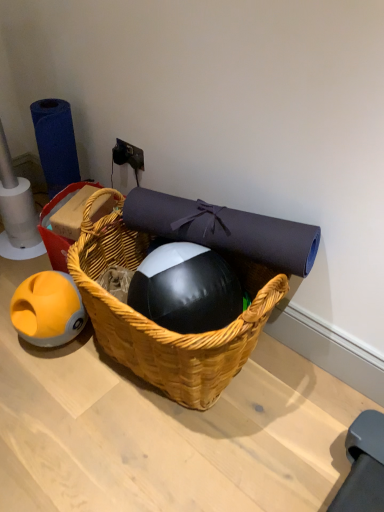
Question: Considering the relative positions of blue matte roll of toilet paper at left and woven wood picnic basket at center in the image provided, is blue matte roll of toilet paper at left to the right of woven wood picnic basket at center from the viewer's perspective?

Choices:
 (A) yes
 (B) no

Answer: (B)

Question: Can you confirm if blue matte roll of toilet paper at left is positioned to the left of woven wood picnic basket at center?

Choices:
 (A) no
 (B) yes

Answer: (B)

Question: Is blue matte roll of toilet paper at left placed right next to woven wood picnic basket at center?

Choices:
 (A) no
 (B) yes

Answer: (A)

Question: Is blue matte roll of toilet paper at left positioned behind woven wood picnic basket at center?

Choices:
 (A) no
 (B) yes

Answer: (B)

Question: From a real-world perspective, is blue matte roll of toilet paper at left on woven wood picnic basket at center?

Choices:
 (A) yes
 (B) no

Answer: (A)

Question: Does blue matte roll of toilet paper at left come in front of woven wood picnic basket at center?

Choices:
 (A) yes
 (B) no

Answer: (B)

Question: Is woven wood picnic basket at center thinner than woven wood basket at center?

Choices:
 (A) yes
 (B) no

Answer: (B)

Question: From a real-world perspective, is woven wood picnic basket at center located higher than woven wood basket at center?

Choices:
 (A) no
 (B) yes

Answer: (A)

Question: From the image's perspective, is woven wood picnic basket at center under woven wood basket at center?

Choices:
 (A) yes
 (B) no

Answer: (A)

Question: Is woven wood picnic basket at center in contact with woven wood basket at center?

Choices:
 (A) yes
 (B) no

Answer: (B)

Question: Is woven wood picnic basket at center oriented away from woven wood basket at center?

Choices:
 (A) yes
 (B) no

Answer: (B)

Question: Does woven wood picnic basket at center contain woven wood basket at center?

Choices:
 (A) yes
 (B) no

Answer: (B)

Question: Is blue matte roll of toilet paper at left taller than woven wood basket at center?

Choices:
 (A) no
 (B) yes

Answer: (B)